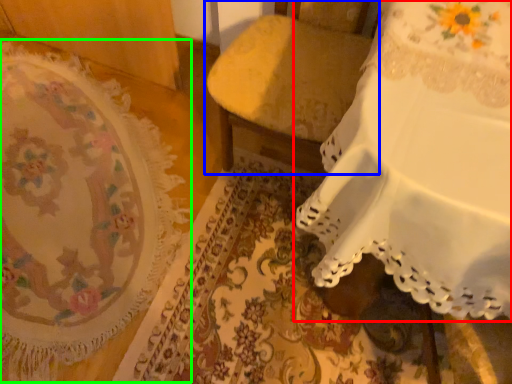
Question: Estimate the real-world distances between objects in this image. Which object is farther from furniture (highlighted by a red box), furniture (highlighted by a blue box) or mat (highlighted by a green box)?

Choices:
 (A) furniture
 (B) mat

Answer: (B)